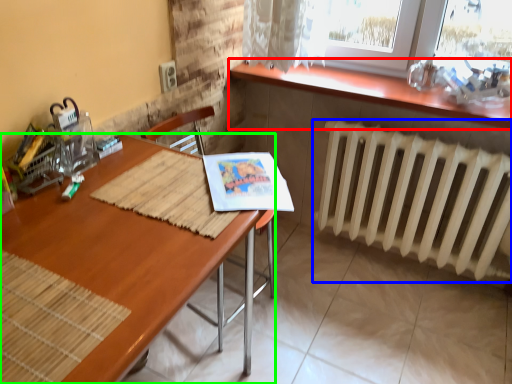
Question: Which object is the closest to the table (highlighted by a red box)? Choose among these: radiator (highlighted by a blue box) or desk (highlighted by a green box).

Choices:
 (A) radiator
 (B) desk

Answer: (A)